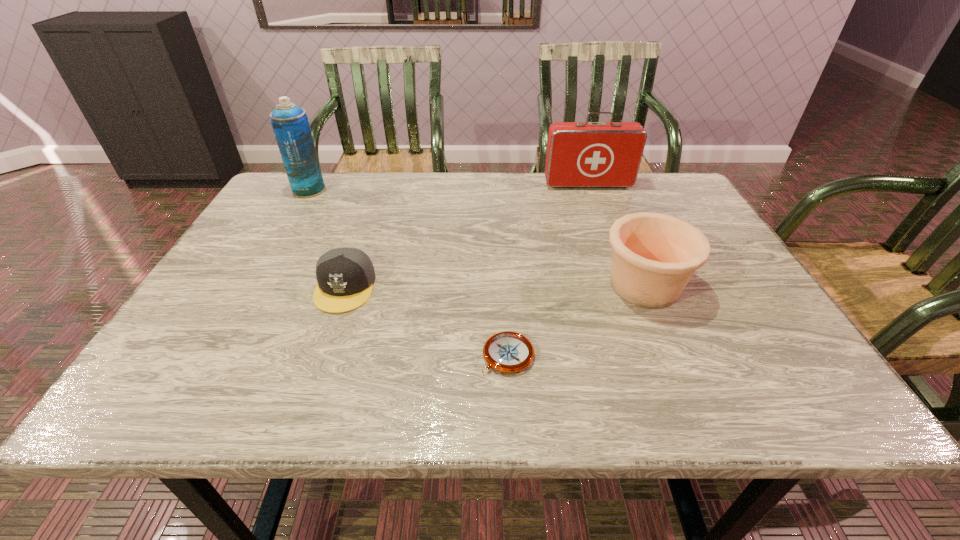
Find the location of a particular element. This screenshot has width=960, height=540. object located in the far right corner section of the desktop is located at coordinates (579, 154).

Find the location of a particular element. The height and width of the screenshot is (540, 960). free spot at the far edge of the desktop is located at coordinates (542, 188).

Where is `vacant space at the near edge of the desktop`? This screenshot has height=540, width=960. vacant space at the near edge of the desktop is located at coordinates (606, 383).

The image size is (960, 540). I want to click on free space at the left edge of the desktop, so click(x=284, y=278).

This screenshot has height=540, width=960. Find the location of `free space at the right edge`. free space at the right edge is located at coordinates (699, 318).

This screenshot has width=960, height=540. What are the coordinates of `vacant area between the pottery and the aerosol can` in the screenshot? It's located at (477, 238).

Find the location of a particular element. free space that is in between the nearest object and the pottery is located at coordinates (576, 320).

This screenshot has width=960, height=540. I want to click on free space between the shortest object and the first-aid kit, so click(548, 270).

Find the location of `vacant area between the third shortest object and the cap`. vacant area between the third shortest object and the cap is located at coordinates (494, 286).

At what (x,y) coordinates should I click in order to perform the action: click on unoccupied position between the nearest object and the pottery. Please return your answer as a coordinate pair (x, y). Looking at the image, I should click on (576, 320).